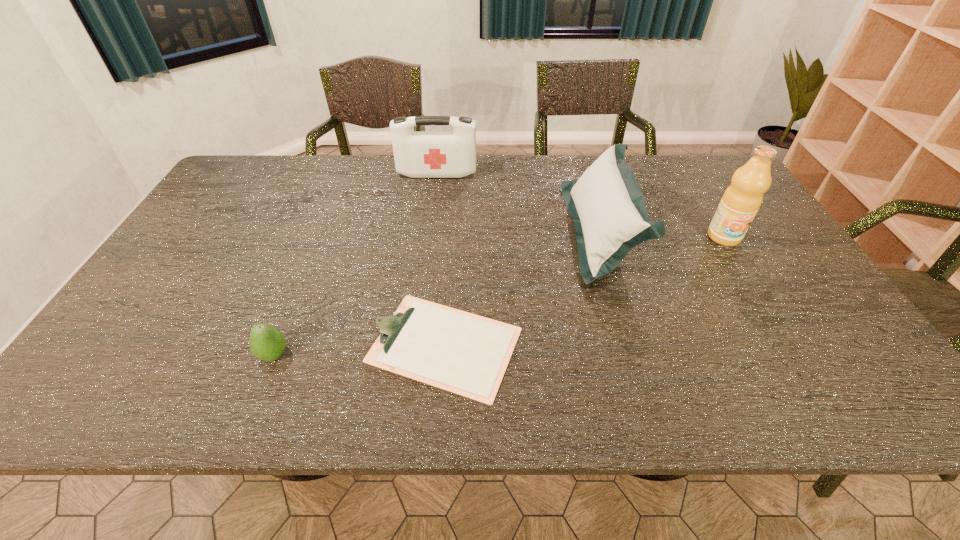
You are a GUI agent. You are given a task and a screenshot of the screen. Output one action in this format:
    pyautogui.click(x=<x>, y=<y>)
    Task: Click on the blank space located on the surface of the fourth object from left to right
    
    Given the screenshot: What is the action you would take?
    pyautogui.click(x=535, y=231)

Locate an element on the screen. This screenshot has width=960, height=540. vacant space located on the surface of the fourth object from left to right is located at coordinates (496, 231).

At what (x,y) coordinates should I click in order to perform the action: click on vacant space located on the right of the leftmost object. Please return your answer as a coordinate pair (x, y). This screenshot has width=960, height=540. Looking at the image, I should click on [x=433, y=355].

You are a GUI agent. You are given a task and a screenshot of the screen. Output one action in this format:
    pyautogui.click(x=<x>, y=<y>)
    Task: Click on the vacant space located 0.260m on the right of the clipboard
    The height and width of the screenshot is (540, 960).
    Given the screenshot: What is the action you would take?
    pyautogui.click(x=639, y=345)

The height and width of the screenshot is (540, 960). I want to click on the first-aid kit situated at the far edge, so click(418, 154).

This screenshot has height=540, width=960. In order to click on cushion that is at the far edge in this screenshot , I will do `click(607, 206)`.

At what (x,y) coordinates should I click in order to perform the action: click on object located in the near edge section of the desktop. Please return your answer as a coordinate pair (x, y). The width and height of the screenshot is (960, 540). Looking at the image, I should click on (466, 354).

Locate an element on the screen. The image size is (960, 540). object present at the right edge is located at coordinates (742, 199).

The height and width of the screenshot is (540, 960). In order to click on free space at the far edge in this screenshot , I will do `click(278, 185)`.

At what (x,y) coordinates should I click in order to perform the action: click on vacant space at the near edge of the desktop. Please return your answer as a coordinate pair (x, y). Looking at the image, I should click on (642, 381).